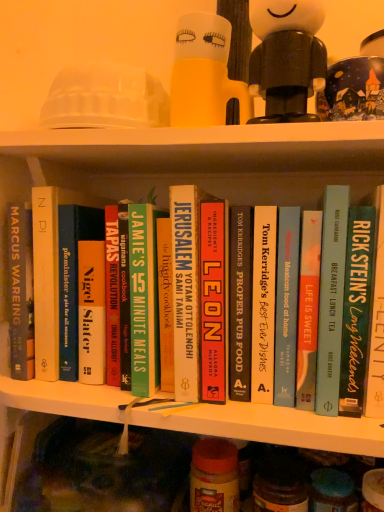
Question: Is hardcover book at center, the 4th book positioned from the left, not within translucent yellow cup at upper center?

Choices:
 (A) no
 (B) yes

Answer: (B)

Question: From the image's perspective, is hardcover book at center, the 4th book positioned from the left, under translucent yellow cup at upper center?

Choices:
 (A) yes
 (B) no

Answer: (A)

Question: From a real-world perspective, is hardcover book at center, which is counted as the 5th book, starting from the right, physically above translucent yellow cup at upper center?

Choices:
 (A) no
 (B) yes

Answer: (A)

Question: Does hardcover book at center, which is counted as the 5th book, starting from the right, turn towards translucent yellow cup at upper center?

Choices:
 (A) no
 (B) yes

Answer: (A)

Question: From a real-world perspective, is hardcover book at center, which is counted as the 5th book, starting from the right, physically below translucent yellow cup at upper center?

Choices:
 (A) yes
 (B) no

Answer: (A)

Question: From their relative heights in the image, would you say blue glass jar at lower right, the second glass jar when ordered from left to right, is taller or shorter than translucent plastic jar at center, arranged as the second glass jar when viewed from the right?

Choices:
 (A) tall
 (B) short

Answer: (B)

Question: Does point (352, 502) appear closer or farther from the camera than point (206, 440)?

Choices:
 (A) farther
 (B) closer

Answer: (B)

Question: Considering the positions of blue glass jar at lower right, the second glass jar when ordered from left to right, and translucent plastic jar at center, which is the 1th glass jar from left to right, in the image, is blue glass jar at lower right, the second glass jar when ordered from left to right, wider or thinner than translucent plastic jar at center, which is the 1th glass jar from left to right,?

Choices:
 (A) thin
 (B) wide

Answer: (A)

Question: Is blue glass jar at lower right, the second glass jar when ordered from left to right, spatially inside translucent plastic jar at center, arranged as the second glass jar when viewed from the right, or outside of it?

Choices:
 (A) outside
 (B) inside

Answer: (A)

Question: Considering their positions, is hardcover book at center, the 7th book when ordered from left to right, located in front of or behind translucent yellow cup at upper center?

Choices:
 (A) behind
 (B) front

Answer: (B)

Question: From a real-world perspective, is hardcover book at center, the 7th book when ordered from left to right, positioned above or below translucent yellow cup at upper center?

Choices:
 (A) above
 (B) below

Answer: (B)

Question: In terms of width, does hardcover book at center, the 7th book when ordered from left to right, look wider or thinner when compared to translucent yellow cup at upper center?

Choices:
 (A) thin
 (B) wide

Answer: (B)

Question: Is hardcover book at center, acting as the 2th book starting from the right, situated inside translucent yellow cup at upper center or outside?

Choices:
 (A) inside
 (B) outside

Answer: (B)

Question: In terms of width, does green matte book at center, the 2th book positioned from the left, look wider or thinner when compared to hardcover book at center, the sixth book from the left?

Choices:
 (A) wide
 (B) thin

Answer: (B)

Question: Considering the positions of green matte book at center, the 2th book positioned from the left, and hardcover book at center, placed as the 3th book when sorted from right to left, in the image, is green matte book at center, the 2th book positioned from the left, taller or shorter than hardcover book at center, placed as the 3th book when sorted from right to left,?

Choices:
 (A) short
 (B) tall

Answer: (A)